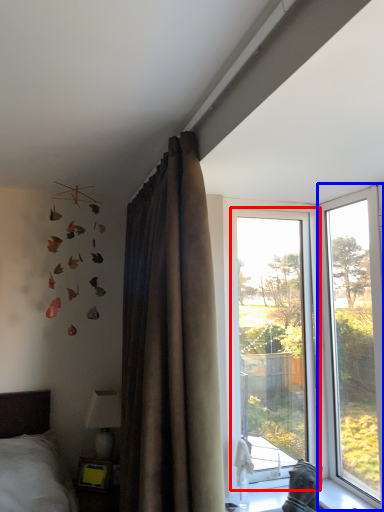
Question: Which point is closer to the camera, window (highlighted by a red box) or window (highlighted by a blue box)?

Choices:
 (A) window
 (B) window

Answer: (B)